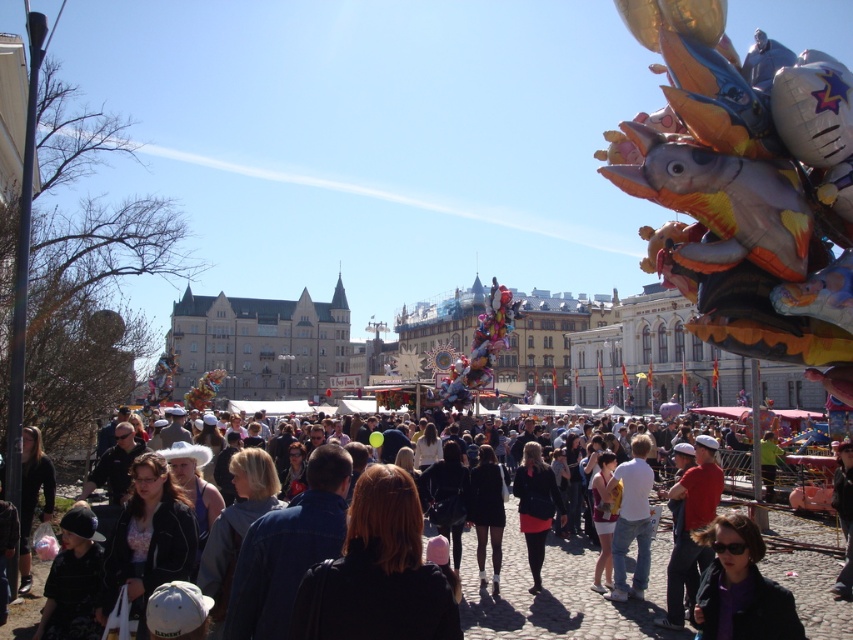
Question: Which of the following is the closest to the observer?

Choices:
 (A) (352, 516)
 (B) (712, 600)
 (C) (703, 552)

Answer: (A)

Question: Can you confirm if purple matte jacket at lower right is wider than matte black jacket at center?

Choices:
 (A) no
 (B) yes

Answer: (A)

Question: Can you confirm if dark brown leather jacket at center is positioned to the left of dark brown hair at center?

Choices:
 (A) no
 (B) yes

Answer: (A)

Question: Which point appears closest to the camera in this image?

Choices:
 (A) (521, 493)
 (B) (828, 596)
 (C) (717, 444)

Answer: (B)

Question: Estimate the real-world distances between objects in this image. Which object is farther from the dark brown hair at center?

Choices:
 (A) dark brown leather jacket at center
 (B) matte black jacket at center

Answer: (B)

Question: Does dark brown hair at center appear over matte black jacket at center?

Choices:
 (A) yes
 (B) no

Answer: (A)